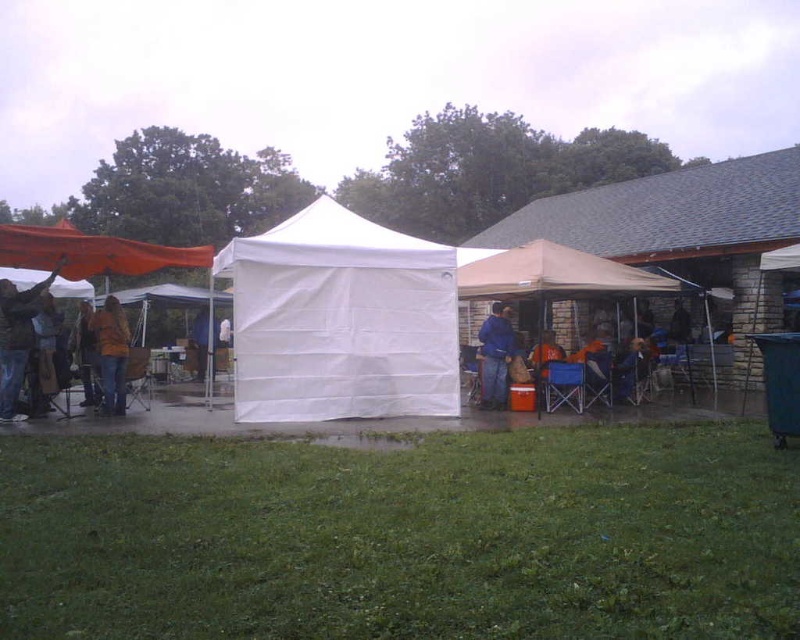
You are standing at the point labeled point (425, 262) and want to walk towards the point labeled point (197, 337). Given that you can only move in a straight line, will you be moving towards the background or the foreground of the image?

Since point (425, 262) is closer to the viewer than point (197, 337), moving from point (425, 262) towards point (197, 337) would mean moving towards the background of the image.

You are a photographer setting up a tripod in the scene. You need to position it so that the orange fabric canopy at left and the blue denim jeans at center are both visible in the frame. Considering their heights, which object should you place closer to the camera to ensure both are fully visible?

The orange fabric canopy at left is much taller than the blue denim jeans at center. To ensure both are fully visible in the frame, you should place the orange fabric canopy at left closer to the camera so its height doesn

You are at an outdoor event and see the tan fabric tent at center and the orange fabric at center. Which object is positioned higher relative to the other?

The tan fabric tent at center is located above the orange fabric at center, so it is positioned higher.